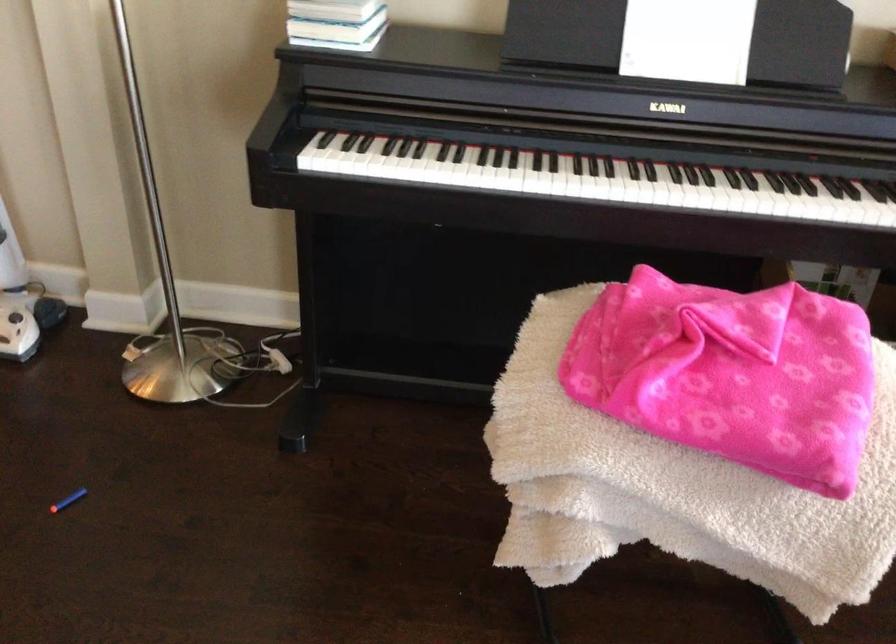
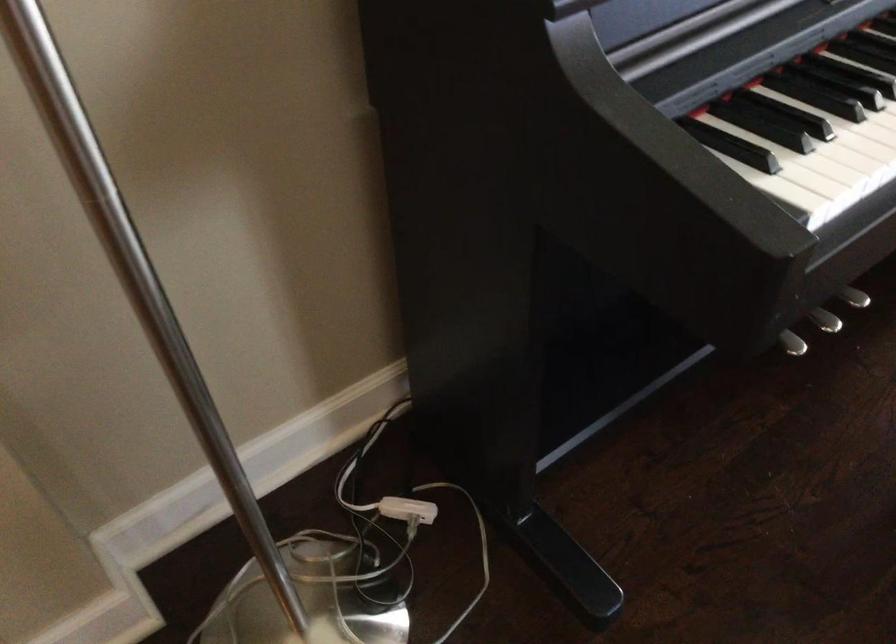
In the second image, find the point that corresponds to (x=264, y=352) in the first image.

(408, 509)